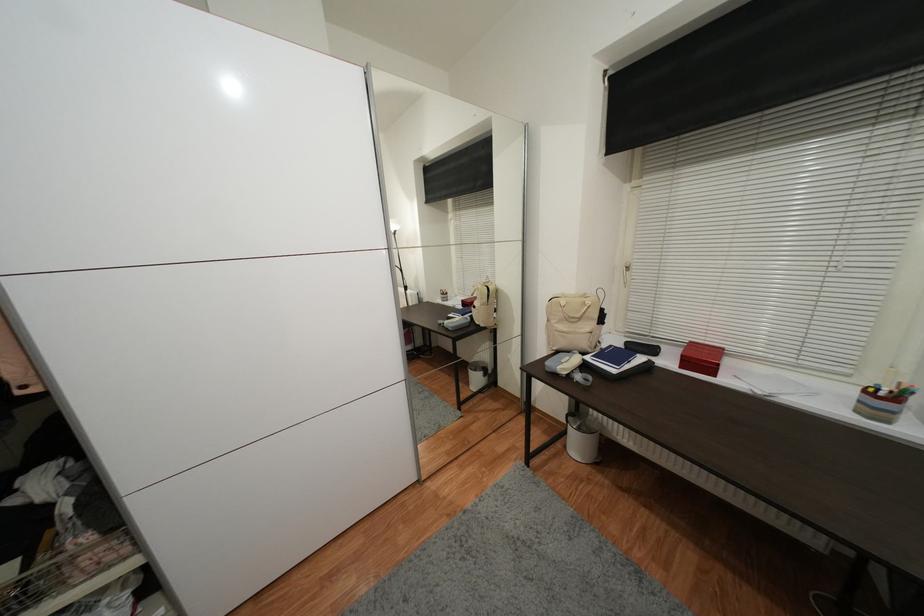
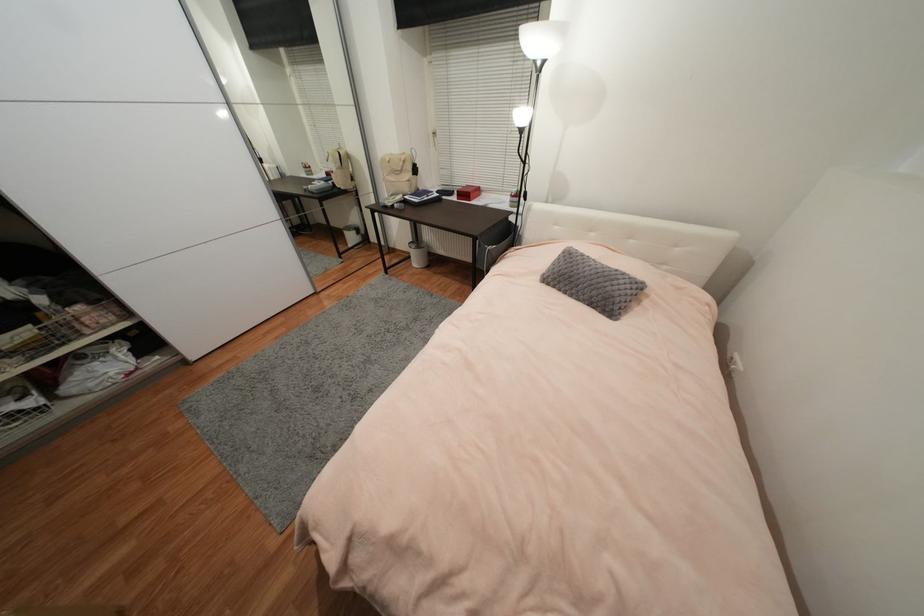
The point at (590, 346) is marked in the first image. Where is the corresponding point in the second image?

(410, 191)